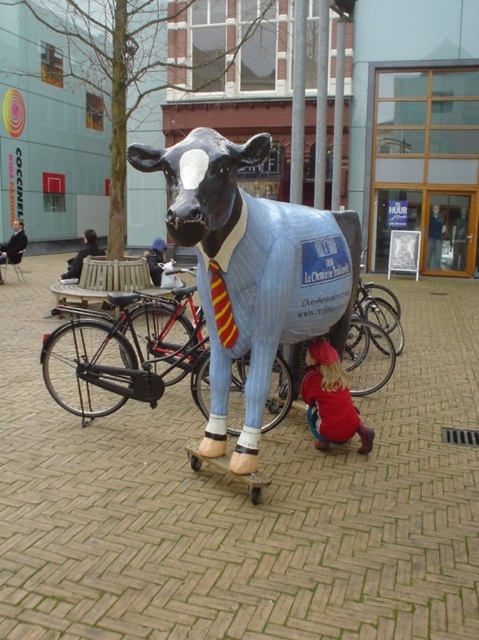
Question: Where is red fabric dress at lower right located in relation to yellow striped tie at center in the image?

Choices:
 (A) left
 (B) right

Answer: (B)

Question: Among these objects, which one is nearest to the camera?

Choices:
 (A) matte blue cow at center
 (B) dark blue suit at left
 (C) black matte bicycle at center
 (D) yellow striped tie at center

Answer: (A)

Question: Is matte blue cow at center wider than red fabric dress at lower right?

Choices:
 (A) no
 (B) yes

Answer: (B)

Question: Can you confirm if red fabric dress at lower right is thinner than yellow striped tie at center?

Choices:
 (A) no
 (B) yes

Answer: (A)

Question: Among these objects, which one is farthest from the camera?

Choices:
 (A) yellow striped tie at center
 (B) dark blue suit at left
 (C) black matte bicycle at center
 (D) matte blue cow at center

Answer: (B)

Question: Estimate the real-world distances between objects in this image. Which object is farther from the black matte bicycle at center?

Choices:
 (A) matte blue cow at center
 (B) dark blue suit at left

Answer: (B)